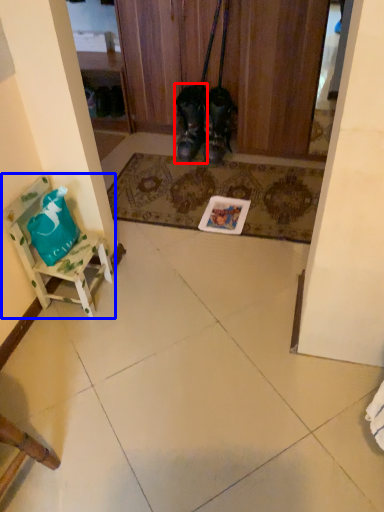
Question: Which point is closer to the camera, footwear (highlighted by a red box) or furniture (highlighted by a blue box)?

Choices:
 (A) footwear
 (B) furniture

Answer: (B)